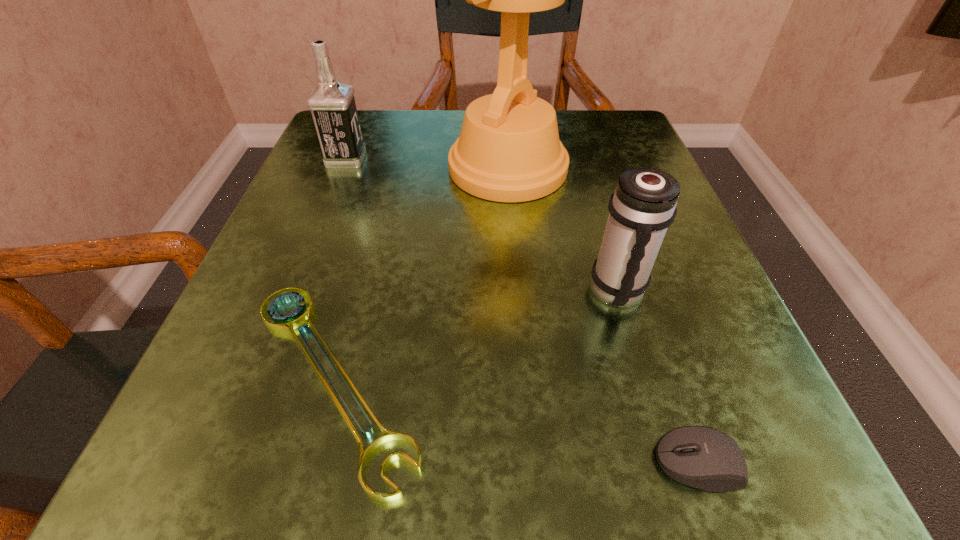
This screenshot has height=540, width=960. I want to click on object at the near right corner, so click(x=702, y=457).

Identify the location of blank area at the far edge. The width and height of the screenshot is (960, 540). (394, 166).

This screenshot has height=540, width=960. Identify the location of vacant space at the near edge. (438, 447).

I want to click on free space at the left edge of the desktop, so click(335, 181).

Identify the location of vacant region at the right edge of the desktop. (662, 305).

I want to click on vacant space at the far left corner of the desktop, so click(375, 156).

Identify the location of vacant space at the near left corner. Image resolution: width=960 pixels, height=540 pixels. (271, 517).

Where is `vacant space at the far right corner of the desktop`? Image resolution: width=960 pixels, height=540 pixels. vacant space at the far right corner of the desktop is located at coordinates (651, 165).

Where is `vacant space that's between the second tallest object and the shortest object`? Image resolution: width=960 pixels, height=540 pixels. vacant space that's between the second tallest object and the shortest object is located at coordinates (339, 269).

The height and width of the screenshot is (540, 960). I want to click on vacant space that's between the shortest object and the tallest object, so click(x=420, y=273).